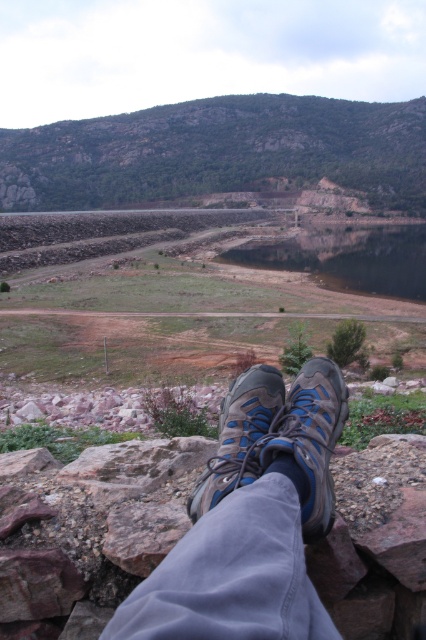
Can you confirm if smooth reflective water at center is wider than blue mesh shoe at center?

Correct, the width of smooth reflective water at center exceeds that of blue mesh shoe at center.

In the scene shown: Between smooth reflective water at center and blue mesh shoe at center, which one has more height?

smooth reflective water at center is taller.

The height and width of the screenshot is (640, 426). In order to click on smooth reflective water at center in this screenshot , I will do `click(348, 259)`.

Between blue suede shoes at center and blue mesh shoe at center, which one is positioned higher?

blue mesh shoe at center is higher up.

Between point (273, 387) and point (325, 480), which one is positioned behind?

The point (273, 387) is behind.

The width and height of the screenshot is (426, 640). Identify the location of blue suede shoes at center. (252, 520).

Is blue mesh shoe at center above blue mesh shoe at lower center?

Correct, blue mesh shoe at center is located above blue mesh shoe at lower center.

Which of these two, blue mesh shoe at center or blue mesh shoe at lower center, stands taller?

Standing taller between the two is blue mesh shoe at lower center.

Does point (298, 412) lie behind point (264, 420)?

That is False.

You are a GUI agent. You are given a task and a screenshot of the screen. Output one action in this format:
    pyautogui.click(x=<x>, y=<y>)
    Task: Click on the blue mesh shoe at center
    This screenshot has width=426, height=640.
    Given the screenshot: What is the action you would take?
    pyautogui.click(x=310, y=438)